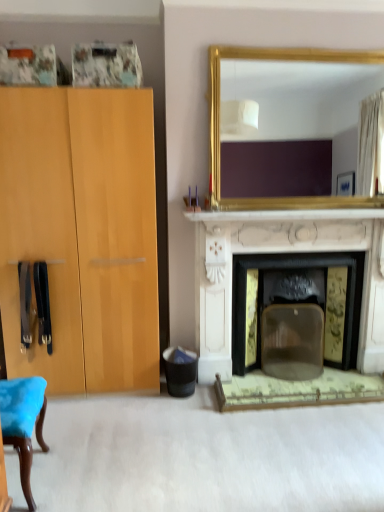
What is the approximate width of white marble fireplace at center?

17.58 inches.

Image resolution: width=384 pixels, height=512 pixels. I want to click on gold-framed mirror at upper center, so click(x=219, y=123).

You are a GUI agent. You are given a task and a screenshot of the screen. Output one action in this format:
    pyautogui.click(x=<x>, y=<y>)
    Task: Click on the white marble fireplace at center
    The height and width of the screenshot is (512, 384).
    Given the screenshot: What is the action you would take?
    pyautogui.click(x=257, y=252)

Which is behind, white marble fireplace at center or black plastic trash bin at lower center?

black plastic trash bin at lower center is more distant.

Based on their positions, is white marble fireplace at center located to the left or right of black plastic trash bin at lower center?

white marble fireplace at center is positioned on black plastic trash bin at lower center's right side.

Where is `trash bin/can that is under the white marble fireplace at center (from a real-world perspective)`? The height and width of the screenshot is (512, 384). trash bin/can that is under the white marble fireplace at center (from a real-world perspective) is located at coordinates (180, 371).

Is black plastic trash bin at lower center a part of white marble fireplace at center?

No, black plastic trash bin at lower center is not a part of white marble fireplace at center.

Is white marble fireplace at center inside black plastic trash bin at lower center?

No, white marble fireplace at center is located outside of black plastic trash bin at lower center.

From the image's perspective, between black plastic trash bin at lower center and white marble fireplace at center, who is located below?

From the image's view, black plastic trash bin at lower center is below.

Is point (183, 367) positioned behind point (365, 281)?

No.

From the picture: Who is bigger, black plastic trash bin at lower center or white marble fireplace at center?

white marble fireplace at center is bigger.

Is black plastic trash bin at lower center further to camera compared to gold-framed mirror at upper center?

Yes, the depth of black plastic trash bin at lower center is greater than that of gold-framed mirror at upper center.

Is black plastic trash bin at lower center inside or outside of gold-framed mirror at upper center?

black plastic trash bin at lower center is not enclosed by gold-framed mirror at upper center.

Can you confirm if black plastic trash bin at lower center is bigger than gold-framed mirror at upper center?

No.

The height and width of the screenshot is (512, 384). Find the location of `trash bin/can behind the gold-framed mirror at upper center`. trash bin/can behind the gold-framed mirror at upper center is located at coordinates (180, 371).

Measure the distance between gold-framed mirror at upper center and black plastic trash bin at lower center.

They are 1.35 meters apart.

Is gold-framed mirror at upper center aimed at black plastic trash bin at lower center?

No, gold-framed mirror at upper center is not oriented towards black plastic trash bin at lower center.

Based on the photo, considering the sizes of objects gold-framed mirror at upper center and black plastic trash bin at lower center in the image provided, who is thinner, gold-framed mirror at upper center or black plastic trash bin at lower center?

gold-framed mirror at upper center.

Is gold-framed mirror at upper center far away from black plastic trash bin at lower center?

Yes, gold-framed mirror at upper center is far from black plastic trash bin at lower center.

How distant is white marble fireplace at center from gold-framed mirror at upper center?

20.26 inches.

Is white marble fireplace at center inside or outside of gold-framed mirror at upper center?

white marble fireplace at center exists outside the volume of gold-framed mirror at upper center.

Considering the positions of point (338, 234) and point (383, 204), is point (338, 234) closer or farther from the camera than point (383, 204)?

Point (338, 234) appears to be farther away from the viewer than point (383, 204).

From the image's perspective, is gold-framed mirror at upper center above white marble fireplace at center?

Yes, from the image's perspective, gold-framed mirror at upper center is on top of white marble fireplace at center.

Is gold-framed mirror at upper center positioned behind white marble fireplace at center?

No, it is in front of white marble fireplace at center.

Considering the relative sizes of gold-framed mirror at upper center and white marble fireplace at center in the image provided, is gold-framed mirror at upper center shorter than white marble fireplace at center?

Yes.

Considering the positions of points (233, 51) and (383, 314), is point (233, 51) farther from camera compared to point (383, 314)?

No, (233, 51) is closer to viewer.

Locate an element on the screen. The image size is (384, 512). trash bin/can lying on the left of white marble fireplace at center is located at coordinates (180, 371).

Where is `fireplace located above the black plastic trash bin at lower center (from a real-world perspective)`? The image size is (384, 512). fireplace located above the black plastic trash bin at lower center (from a real-world perspective) is located at coordinates (257, 252).

Looking at the image, which one is located further to gold-framed mirror at upper center, black plastic trash bin at lower center or white marble fireplace at center?

The object further to gold-framed mirror at upper center is black plastic trash bin at lower center.

Which object lies further to the anchor point black plastic trash bin at lower center, white marble fireplace at center or gold-framed mirror at upper center?

gold-framed mirror at upper center lies further to black plastic trash bin at lower center than the other object.

Based on their spatial positions, is black plastic trash bin at lower center or gold-framed mirror at upper center closer to white marble fireplace at center?

gold-framed mirror at upper center is positioned closer to the anchor white marble fireplace at center.

Considering their positions, is gold-framed mirror at upper center positioned further to black plastic trash bin at lower center than white marble fireplace at center?

Based on the image, gold-framed mirror at upper center appears to be further to black plastic trash bin at lower center.

Consider the image. From the image, which object appears to be farther from white marble fireplace at center, gold-framed mirror at upper center or black plastic trash bin at lower center?

The object further to white marble fireplace at center is black plastic trash bin at lower center.

Considering their positions, is white marble fireplace at center positioned further to gold-framed mirror at upper center than black plastic trash bin at lower center?

black plastic trash bin at lower center is further to gold-framed mirror at upper center.

You are a GUI agent. You are given a task and a screenshot of the screen. Output one action in this format:
    pyautogui.click(x=<x>, y=<y>)
    Task: Click on the fireplace between gold-framed mirror at upper center and black plastic trash bin at lower center in the up-down direction
    
    Given the screenshot: What is the action you would take?
    pyautogui.click(x=257, y=252)